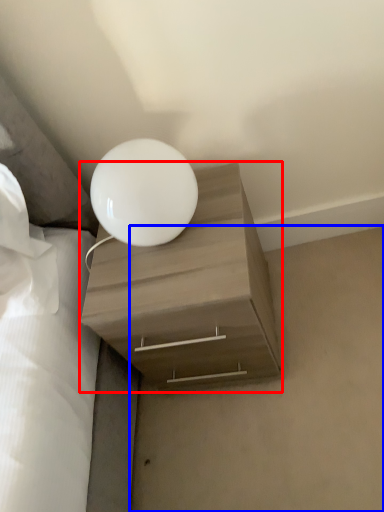
Question: Which point is further to the camera, nightstand (highlighted by a red box) or concrete (highlighted by a blue box)?

Choices:
 (A) nightstand
 (B) concrete

Answer: (B)